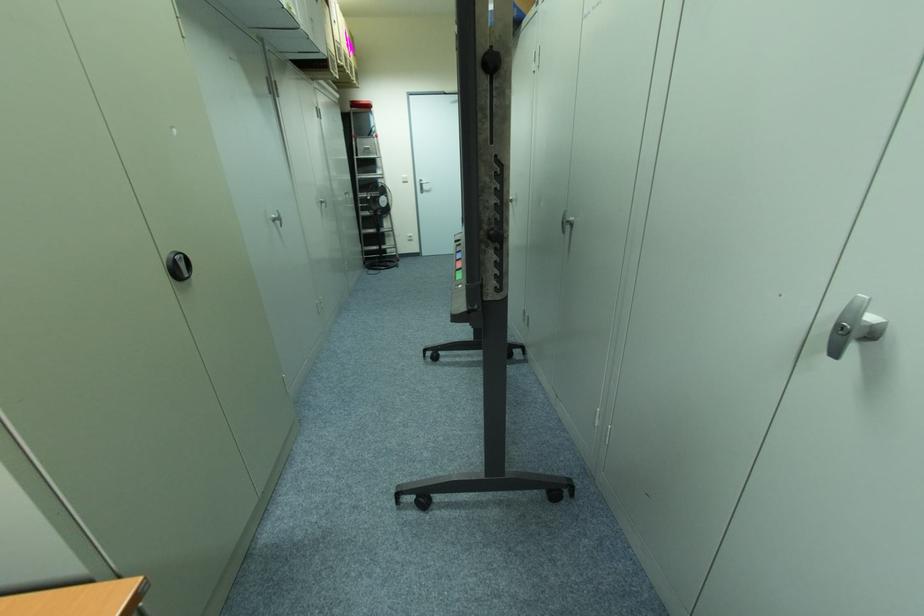
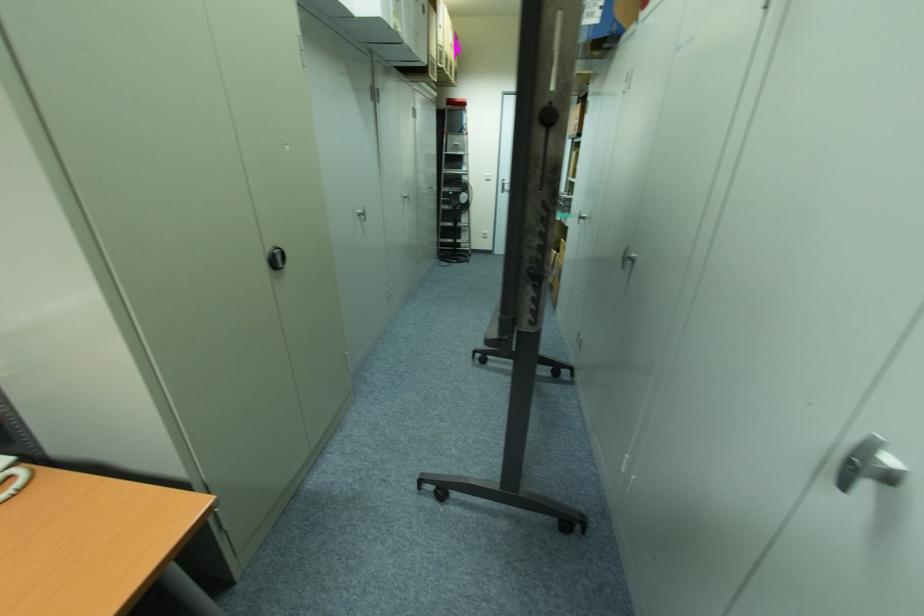
Where in the second image is the point corresponding to point 274,220 from the first image?

(361, 215)